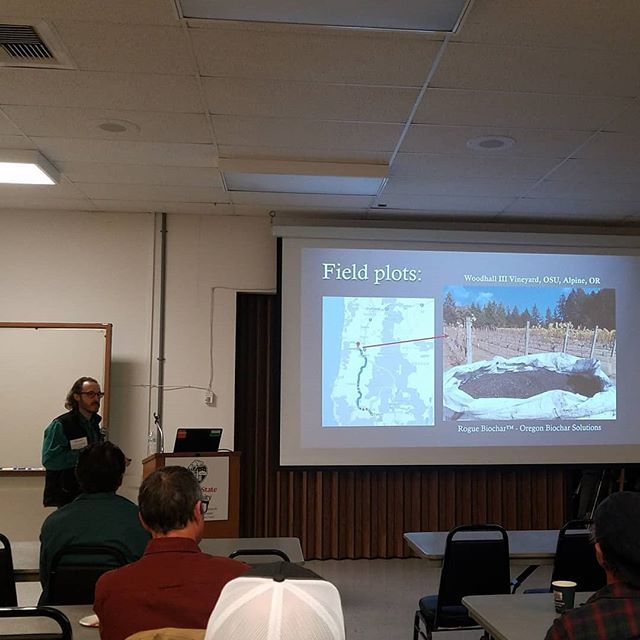
The height and width of the screenshot is (640, 640). Identify the location of white board. (81, 337).